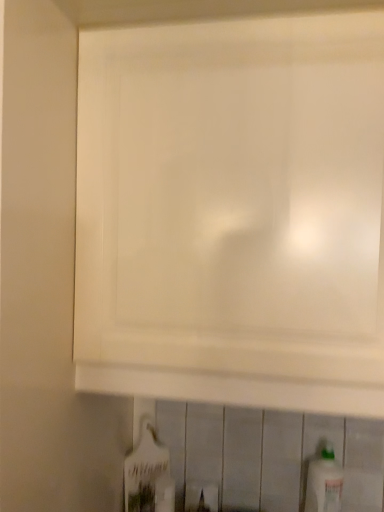
Where is `white matte cabinet at upper center`? This screenshot has height=512, width=384. white matte cabinet at upper center is located at coordinates tap(233, 212).

Is white glossy bottle at lower center, which is the 2th bottle in right-to-left order, wider than white matte cabinet at upper center?

Incorrect, the width of white glossy bottle at lower center, which is the 2th bottle in right-to-left order, does not surpass that of white matte cabinet at upper center.

From a real-world perspective, which is physically above, white glossy bottle at lower center, which is the 2th bottle in right-to-left order, or white matte cabinet at upper center?

In real-world perspective, white matte cabinet at upper center is above.

Would you say white matte cabinet at upper center is part of white glossy bottle at lower center, which ranks as the 1th bottle in left-to-right order,'s contents?

No.

From the picture: Who is taller, white matte cabinet at upper center or white glossy bottle at lower center, which ranks as the 1th bottle in left-to-right order?

white matte cabinet at upper center is taller.

Consider the image. Is white matte cabinet at upper center to the left of white glossy bottle at lower center, which ranks as the 1th bottle in left-to-right order, from the viewer's perspective?

No.

From a real-world perspective, which is physically above, white matte cabinet at upper center or white glossy bottle at lower center, which is the 2th bottle in right-to-left order?

white matte cabinet at upper center, from a real-world perspective.

Is white glossy bottle at lower center, which is the 2th bottle in right-to-left order, oriented towards white plastic bottle at lower right, which is the 2th bottle from left to right?

No, white glossy bottle at lower center, which is the 2th bottle in right-to-left order, is not aimed at white plastic bottle at lower right, which is the 2th bottle from left to right.

Is white glossy bottle at lower center, which ranks as the 1th bottle in left-to-right order, positioned far away from white plastic bottle at lower right, which is the 2th bottle from left to right?

white glossy bottle at lower center, which ranks as the 1th bottle in left-to-right order, is actually quite close to white plastic bottle at lower right, which is the 2th bottle from left to right.

From the image's perspective, who appears lower, white glossy bottle at lower center, which is the 2th bottle in right-to-left order, or white plastic bottle at lower right, the first bottle positioned from the right?

white plastic bottle at lower right, the first bottle positioned from the right, is shown below in the image.

In terms of size, does white glossy bottle at lower center, which ranks as the 1th bottle in left-to-right order, appear bigger or smaller than white plastic bottle at lower right, the first bottle positioned from the right?

Clearly, white glossy bottle at lower center, which ranks as the 1th bottle in left-to-right order, is smaller in size than white plastic bottle at lower right, the first bottle positioned from the right.

Locate an element on the screen. The height and width of the screenshot is (512, 384). cabinetry located above the white plastic bottle at lower right, the first bottle positioned from the right (from the image's perspective) is located at coordinates (233, 212).

Is white plastic bottle at lower right, the first bottle positioned from the right, turned away from white matte cabinet at upper center?

No, white matte cabinet at upper center is not at the back of white plastic bottle at lower right, the first bottle positioned from the right.

Is white plastic bottle at lower right, the first bottle positioned from the right, next to white matte cabinet at upper center and touching it?

No.

Do you think white plastic bottle at lower right, which is the 2th bottle from left to right, is within white matte cabinet at upper center, or outside of it?

white plastic bottle at lower right, which is the 2th bottle from left to right, is outside white matte cabinet at upper center.

Who is smaller, white plastic bottle at lower right, which is the 2th bottle from left to right, or white glossy bottle at lower center, which is the 2th bottle in right-to-left order?

Smaller between the two is white glossy bottle at lower center, which is the 2th bottle in right-to-left order.

Where is `bottle above the white plastic bottle at lower right, which is the 2th bottle from left to right (from a real-world perspective)`? The image size is (384, 512). bottle above the white plastic bottle at lower right, which is the 2th bottle from left to right (from a real-world perspective) is located at coordinates (145, 470).

Choose the correct answer: Is white plastic bottle at lower right, which is the 2th bottle from left to right, inside white glossy bottle at lower center, which ranks as the 1th bottle in left-to-right order, or outside it?

white plastic bottle at lower right, which is the 2th bottle from left to right, is outside white glossy bottle at lower center, which ranks as the 1th bottle in left-to-right order.

Which object is positioned more to the right, white plastic bottle at lower right, the first bottle positioned from the right, or white glossy bottle at lower center, which ranks as the 1th bottle in left-to-right order?

white plastic bottle at lower right, the first bottle positioned from the right, is more to the right.

Is white plastic bottle at lower right, the first bottle positioned from the right, at the back of white matte cabinet at upper center?

That's not correct — white matte cabinet at upper center is not looking away from white plastic bottle at lower right, the first bottle positioned from the right.

From the image's perspective, is white matte cabinet at upper center on white plastic bottle at lower right, the first bottle positioned from the right?

Yes, from the image's perspective, white matte cabinet at upper center is above white plastic bottle at lower right, the first bottle positioned from the right.

Can we say white matte cabinet at upper center lies outside white plastic bottle at lower right, the first bottle positioned from the right?

Indeed, white matte cabinet at upper center is completely outside white plastic bottle at lower right, the first bottle positioned from the right.

Which object is positioned more to the left, white matte cabinet at upper center or white plastic bottle at lower right, which is the 2th bottle from left to right?

Positioned to the left is white matte cabinet at upper center.

Where is `cabinetry positioned vertically above the white glossy bottle at lower center, which ranks as the 1th bottle in left-to-right order (from a real-world perspective)`? The width and height of the screenshot is (384, 512). cabinetry positioned vertically above the white glossy bottle at lower center, which ranks as the 1th bottle in left-to-right order (from a real-world perspective) is located at coordinates (233, 212).

The width and height of the screenshot is (384, 512). What are the coordinates of `the 1st bottle below the white matte cabinet at upper center (from the image's perspective)` in the screenshot? It's located at (145, 470).

Looking at this image, from the image, which object appears to be nearer to white glossy bottle at lower center, which is the 2th bottle in right-to-left order, white matte cabinet at upper center or white plastic bottle at lower right, the first bottle positioned from the right?

white plastic bottle at lower right, the first bottle positioned from the right.

Based on the photo, when comparing their distances from white plastic bottle at lower right, which is the 2th bottle from left to right, does white matte cabinet at upper center or white glossy bottle at lower center, which ranks as the 1th bottle in left-to-right order, seem closer?

white glossy bottle at lower center, which ranks as the 1th bottle in left-to-right order.

Based on their spatial positions, is white plastic bottle at lower right, the first bottle positioned from the right, or white matte cabinet at upper center closer to white glossy bottle at lower center, which is the 2th bottle in right-to-left order?

Among the two, white plastic bottle at lower right, the first bottle positioned from the right, is located nearer to white glossy bottle at lower center, which is the 2th bottle in right-to-left order.

In the scene shown: From the image, which object appears to be nearer to white matte cabinet at upper center, white plastic bottle at lower right, the first bottle positioned from the right, or white glossy bottle at lower center, which is the 2th bottle in right-to-left order?

Based on the image, white glossy bottle at lower center, which is the 2th bottle in right-to-left order, appears to be nearer to white matte cabinet at upper center.

From the image, which object appears to be farther from white plastic bottle at lower right, which is the 2th bottle from left to right, white glossy bottle at lower center, which is the 2th bottle in right-to-left order, or white matte cabinet at upper center?

white matte cabinet at upper center is further to white plastic bottle at lower right, which is the 2th bottle from left to right.

Looking at the image, which one is located further to white matte cabinet at upper center, white glossy bottle at lower center, which ranks as the 1th bottle in left-to-right order, or white plastic bottle at lower right, which is the 2th bottle from left to right?

white plastic bottle at lower right, which is the 2th bottle from left to right, lies further to white matte cabinet at upper center than the other object.

This screenshot has width=384, height=512. Find the location of `bottle between white matte cabinet at upper center and white plastic bottle at lower right, the first bottle positioned from the right, in the vertical direction`. bottle between white matte cabinet at upper center and white plastic bottle at lower right, the first bottle positioned from the right, in the vertical direction is located at coordinates (145, 470).